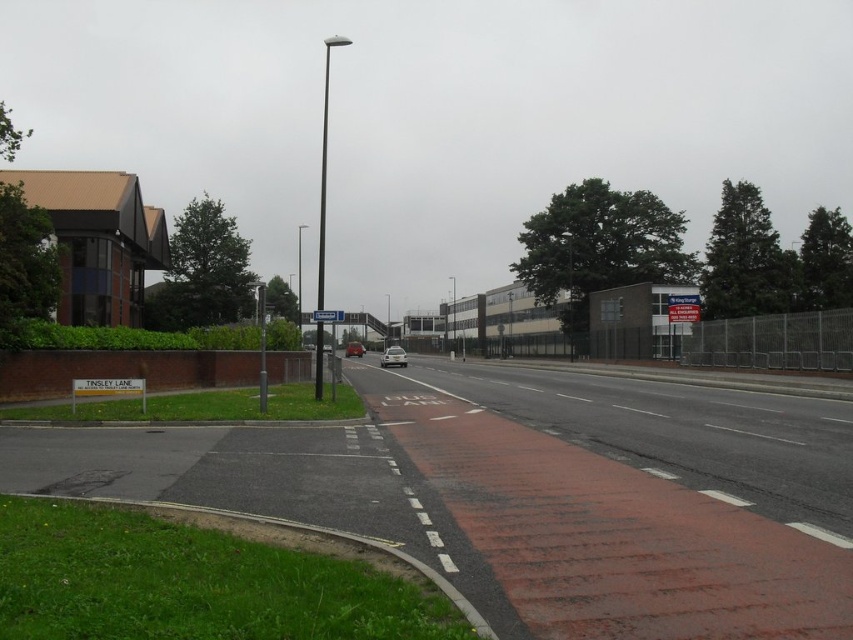
Consider the image. You are a delivery person with a 2.5 meter wide delivery truck. You need to park your truck on the red brick sidewalk at center. The silver metallic car at center is currently parked there. Can you park your truck there without overlapping the car?

The red brick sidewalk at center might be wider than silver metallic car at center, so there is a possibility that the sidewalk is wide enough to accommodate the 2.5 meter wide truck alongside the silver metallic car at center. However, without exact measurements, it is uncertain if there will be enough space. Proceed with caution and ensure the sidewalk is not occupied by other obstacles.

You are a delivery person trying to park your matte silver car at center on the red brick sidewalk at center. Based on the scene description, can your car fit on the sidewalk without overhanging?

The red brick sidewalk at center is wider than the matte silver car at center, so yes, the car can fit on the sidewalk without overhanging.

In the scene shown: You are a delivery robot positioned at the point marked as point (635, 499). You need to reach the red brick sidewalk at center. Which direction should you move to reach it?

The red brick sidewalk at center is already located at the point (635, 499), so you are already at the correct location.